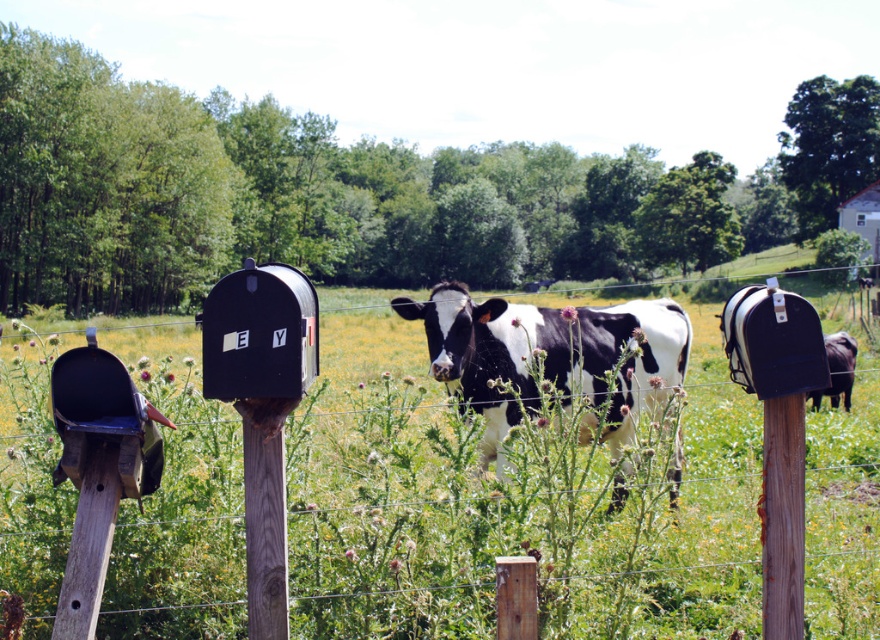
Is point (195, 544) less distant than point (251, 484)?

No, (195, 544) is behind (251, 484).

Is green grass at center to the left of weathered wood post at center from the viewer's perspective?

Incorrect, green grass at center is not on the left side of weathered wood post at center.

Is point (204, 634) less distant than point (247, 417)?

No, (204, 634) is further to viewer.

Identify the location of green grass at center. This screenshot has height=640, width=880. (511, 509).

Is black matte mailbox at center bigger than wooden post at center?

Actually, black matte mailbox at center might be smaller than wooden post at center.

Is black matte mailbox at center closer to camera compared to wooden post at center?

Yes, it is in front of wooden post at center.

The height and width of the screenshot is (640, 880). What do you see at coordinates (259, 333) in the screenshot? I see `black matte mailbox at center` at bounding box center [259, 333].

In order to click on black matte mailbox at center in this screenshot , I will do `click(259, 333)`.

Looking at this image, who is positioned more to the right, wooden post at center or weathered wood post at center?

wooden post at center

Is wooden post at center wider than weathered wood post at center?

Correct, the width of wooden post at center exceeds that of weathered wood post at center.

Locate an element on the screen. The image size is (880, 640). wooden post at center is located at coordinates (782, 516).

In order to click on wooden post at center in this screenshot , I will do `click(782, 516)`.